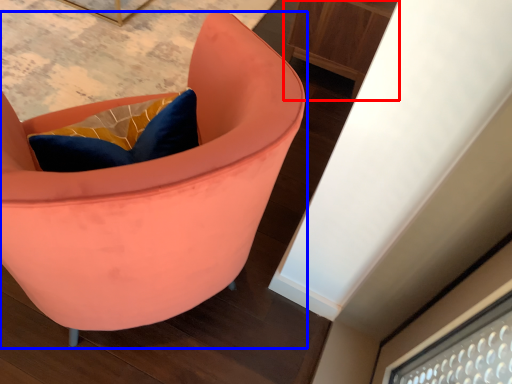
Question: Among these objects, which one is nearest to the camera, furniture (highlighted by a red box) or chair (highlighted by a blue box)?

Choices:
 (A) furniture
 (B) chair

Answer: (B)